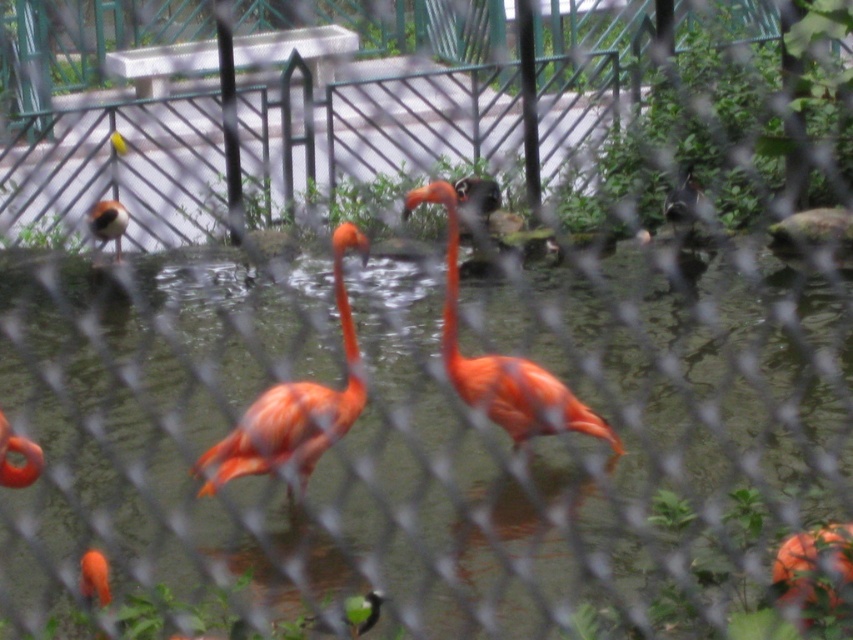
You are standing at the entrance of the flamingo enclosure and want to locate two specific points marked on a map. The first point is at coordinates point (271, 440), and the second is at point (541, 403). Which point is closer to you when you first enter the enclosure?

Point (271, 440) is in front of point (541, 403), so it is closer to you when you first enter the enclosure.

You are standing in front of the flamingo enclosure at the zoo. There is a point marked at coordinates point (222, 454). If you want to touch this point with a 4.5 meter long pole, will you be able to reach it?

The point (222, 454) is 4.42 meters away from the viewer. Since the pole is 4.5 meters long, which is slightly longer than the distance to the point, you can just barely reach it with the pole.

You are a zookeeper observing the enclosure. You notice the orange matte flamingo at center and the brown speckled bird at upper left. Which bird is located to the right of the other?

The orange matte flamingo at center is positioned on the right side of brown speckled bird at upper left.